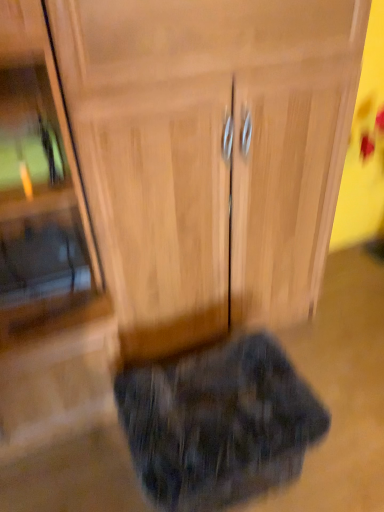
You are a GUI agent. You are given a task and a screenshot of the screen. Output one action in this format:
    pyautogui.click(x=<x>, y=<y>)
    Task: Click on the vacant area that is situated to the right of wooden cabinet at center
    The image size is (384, 512).
    Given the screenshot: What is the action you would take?
    pyautogui.click(x=338, y=344)